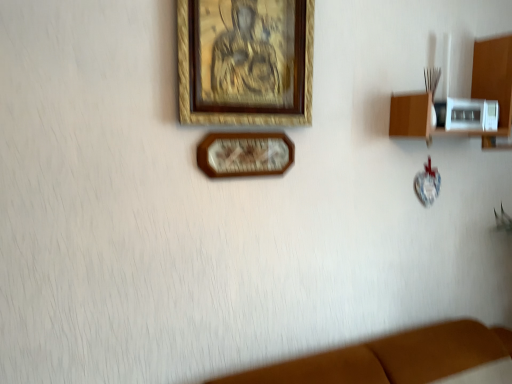
Question: Which direction should I rotate to face wooden picture frame at upper center, positioned as the 2th picture frame in bottom-to-top order, — up or down?

Choices:
 (A) down
 (B) up

Answer: (B)

Question: Is wooden clock at center, positioned as the 2th picture frame in top-to-bottom order, bigger than wooden picture frame at upper center, acting as the first picture frame starting from the top?

Choices:
 (A) yes
 (B) no

Answer: (B)

Question: Is wooden clock at center, the 1th picture frame positioned from the bottom, aimed at wooden picture frame at upper center, acting as the first picture frame starting from the top?

Choices:
 (A) no
 (B) yes

Answer: (A)

Question: Can you confirm if wooden clock at center, the 1th picture frame positioned from the bottom, is taller than wooden picture frame at upper center, acting as the first picture frame starting from the top?

Choices:
 (A) yes
 (B) no

Answer: (B)

Question: Can you confirm if wooden clock at center, positioned as the 2th picture frame in top-to-bottom order, is shorter than wooden picture frame at upper center, acting as the first picture frame starting from the top?

Choices:
 (A) no
 (B) yes

Answer: (B)

Question: From a real-world perspective, is wooden clock at center, positioned as the 2th picture frame in top-to-bottom order, beneath wooden picture frame at upper center, acting as the first picture frame starting from the top?

Choices:
 (A) yes
 (B) no

Answer: (A)

Question: Considering the relative positions of wooden clock at center, positioned as the 2th picture frame in top-to-bottom order, and wooden picture frame at upper center, positioned as the 2th picture frame in bottom-to-top order, in the image provided, is wooden clock at center, positioned as the 2th picture frame in top-to-bottom order, to the left of wooden picture frame at upper center, positioned as the 2th picture frame in bottom-to-top order, from the viewer's perspective?

Choices:
 (A) yes
 (B) no

Answer: (B)

Question: Is wooden picture frame at upper center, positioned as the 2th picture frame in bottom-to-top order, taller than wooden clock at center, positioned as the 2th picture frame in top-to-bottom order?

Choices:
 (A) no
 (B) yes

Answer: (B)

Question: Is wooden picture frame at upper center, positioned as the 2th picture frame in bottom-to-top order, bigger than wooden clock at center, the 1th picture frame positioned from the bottom?

Choices:
 (A) yes
 (B) no

Answer: (A)

Question: Is wooden picture frame at upper center, positioned as the 2th picture frame in bottom-to-top order, wider than wooden clock at center, the 1th picture frame positioned from the bottom?

Choices:
 (A) yes
 (B) no

Answer: (A)

Question: Considering the relative sizes of wooden picture frame at upper center, acting as the first picture frame starting from the top, and wooden clock at center, the 1th picture frame positioned from the bottom, in the image provided, is wooden picture frame at upper center, acting as the first picture frame starting from the top, shorter than wooden clock at center, the 1th picture frame positioned from the bottom,?

Choices:
 (A) no
 (B) yes

Answer: (A)

Question: From a real-world perspective, does wooden picture frame at upper center, positioned as the 2th picture frame in bottom-to-top order, sit lower than wooden clock at center, the 1th picture frame positioned from the bottom?

Choices:
 (A) yes
 (B) no

Answer: (B)

Question: Is wooden picture frame at upper center, acting as the first picture frame starting from the top, positioned with its back to wooden clock at center, positioned as the 2th picture frame in top-to-bottom order?

Choices:
 (A) yes
 (B) no

Answer: (B)

Question: Is wooden shelf at right bigger than wooden clock at center, the 1th picture frame positioned from the bottom?

Choices:
 (A) no
 (B) yes

Answer: (B)